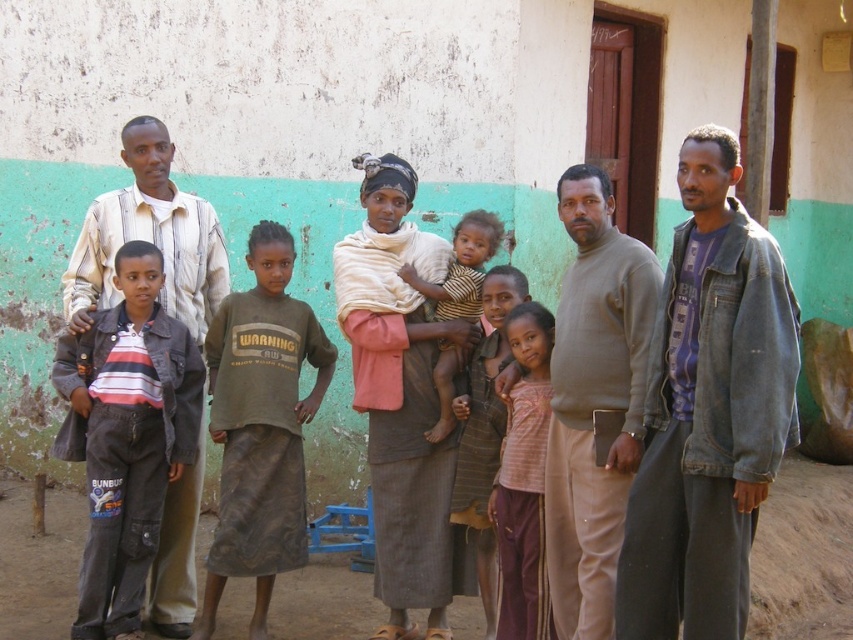
Is denim jacket at right further to camera compared to pink fabric at center?

No, it is in front of pink fabric at center.

Is point (647, 540) farther from camera compared to point (490, 304)?

No.

Is point (701, 424) positioned in front of point (457, 474)?

Yes, it is.

What are the coordinates of `denim jacket at right` in the screenshot? It's located at (708, 410).

From the picture: Who is positioned more to the left, denim jacket at right or brown textured fabric at center?

brown textured fabric at center is more to the left.

Does point (628, 608) come farther from viewer compared to point (407, 320)?

That is False.

Locate an element on the screen. denim jacket at right is located at coordinates (708, 410).

Does brown textured fabric at center have a greater height compared to striped cotton shirt at left?

Yes.

Between point (398, 557) and point (123, 262), which one is positioned behind?

The point (398, 557) is more distant.

Which is behind, point (379, 470) or point (114, 499)?

Point (379, 470)

Where is `brown textured fabric at center`? brown textured fabric at center is located at coordinates (399, 396).